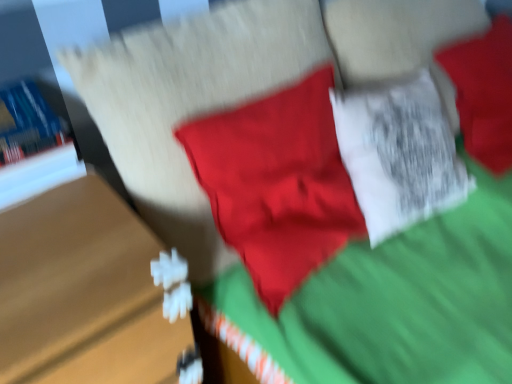
Locate an element on the screen. wooden table at left is located at coordinates (82, 292).

Describe the element at coordinates (82, 292) in the screenshot. I see `wooden table at left` at that location.

Image resolution: width=512 pixels, height=384 pixels. What do you see at coordinates (35, 144) in the screenshot? I see `blue hardcover book at left` at bounding box center [35, 144].

Where is `blue hardcover book at left`? The width and height of the screenshot is (512, 384). blue hardcover book at left is located at coordinates [x=35, y=144].

I want to click on wooden table at left, so click(82, 292).

Is blue hardcover book at left to the left of wooden table at left from the viewer's perspective?

Yes.

Which object is further away from the camera, blue hardcover book at left or wooden table at left?

blue hardcover book at left is behind.

Considering the points (33, 152) and (6, 378), which point is behind, point (33, 152) or point (6, 378)?

Point (33, 152)

In the scene shown: From the image's perspective, would you say blue hardcover book at left is positioned over wooden table at left?

Correct, blue hardcover book at left appears higher than wooden table at left in the image.

From a real-world perspective, which is physically below, blue hardcover book at left or wooden table at left?

From a 3D spatial view, wooden table at left is below.

Which of these two, blue hardcover book at left or wooden table at left, is wider?

Wider between the two is wooden table at left.

Considering the sizes of blue hardcover book at left and wooden table at left in the image, is blue hardcover book at left taller or shorter than wooden table at left?

blue hardcover book at left is shorter than wooden table at left.

Does blue hardcover book at left have a larger size compared to wooden table at left?

No, blue hardcover book at left is not bigger than wooden table at left.

Is blue hardcover book at left spatially inside wooden table at left, or outside of it?

blue hardcover book at left is not inside wooden table at left, it's outside.

Is blue hardcover book at left directly adjacent to wooden table at left?

blue hardcover book at left and wooden table at left are not in contact.

Does blue hardcover book at left turn towards wooden table at left?

No, blue hardcover book at left is not facing towards wooden table at left.

What's the angular difference between blue hardcover book at left and wooden table at left's facing directions?

The angular difference between blue hardcover book at left and wooden table at left is 1.84 degrees.

I want to click on book on the left of wooden table at left, so click(35, 144).

Can you confirm if wooden table at left is positioned to the left of blue hardcover book at left?

Incorrect, wooden table at left is not on the left side of blue hardcover book at left.

Is the position of wooden table at left less distant than that of blue hardcover book at left?

Yes, it is in front of blue hardcover book at left.

Is point (97, 222) in front of point (48, 156)?

Yes, point (97, 222) is in front of point (48, 156).

From the image's perspective, which is below, wooden table at left or blue hardcover book at left?

wooden table at left, from the image's perspective.

From a real-world perspective, which object rests below the other?

wooden table at left is physically lower.

Considering the relative sizes of wooden table at left and blue hardcover book at left in the image provided, is wooden table at left wider than blue hardcover book at left?

Yes, wooden table at left is wider than blue hardcover book at left.

Which of these two, wooden table at left or blue hardcover book at left, stands shorter?

blue hardcover book at left is shorter.

Considering the sizes of wooden table at left and blue hardcover book at left in the image, is wooden table at left bigger or smaller than blue hardcover book at left?

Considering their sizes, wooden table at left takes up more space than blue hardcover book at left.

Is wooden table at left surrounding blue hardcover book at left?

Actually, blue hardcover book at left is outside wooden table at left.

Does wooden table at left touch blue hardcover book at left?

They are not placed beside each other.

Is wooden table at left looking in the opposite direction of blue hardcover book at left?

That's not correct — wooden table at left is not looking away from blue hardcover book at left.

How distant is wooden table at left from blue hardcover book at left?

wooden table at left and blue hardcover book at left are 21.98 centimeters apart from each other.

Find the location of a particular element. The image size is (512, 384). table below the blue hardcover book at left (from the image's perspective) is located at coordinates coord(82,292).

Find the location of `book that appears on the left of wooden table at left`. book that appears on the left of wooden table at left is located at coordinates (35, 144).

You are a GUI agent. You are given a task and a screenshot of the screen. Output one action in this format:
    pyautogui.click(x=<x>, y=<y>)
    Task: Click on the table below the blue hardcover book at left (from the image's perspective)
    This screenshot has height=384, width=512.
    Given the screenshot: What is the action you would take?
    82,292